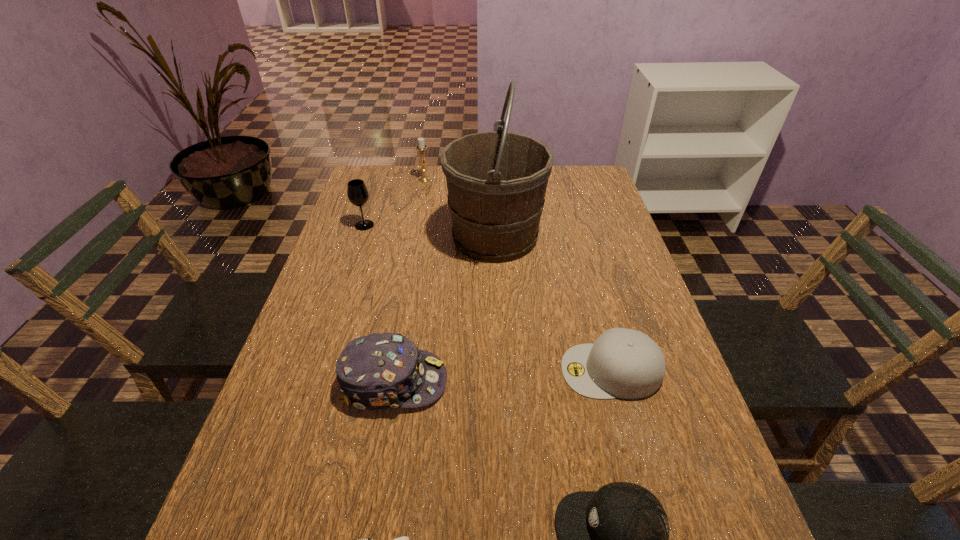
Locate an element on the screen. Image resolution: width=960 pixels, height=540 pixels. headwear that is positioned at the left edge is located at coordinates (379, 371).

At what (x,y) coordinates should I click in order to perform the action: click on object that is positioned at the right edge. Please return your answer as a coordinate pair (x, y). Looking at the image, I should click on (625, 363).

Image resolution: width=960 pixels, height=540 pixels. In the image, there is a desktop. Find the location of `vacant space at the far edge`. vacant space at the far edge is located at coordinates (441, 197).

In the image, there is a desktop. Where is `vacant space at the left edge`? Image resolution: width=960 pixels, height=540 pixels. vacant space at the left edge is located at coordinates (332, 447).

Locate an element on the screen. The width and height of the screenshot is (960, 540). vacant space at the right edge of the desktop is located at coordinates (724, 488).

You are a GUI agent. You are given a task and a screenshot of the screen. Output one action in this format:
    pyautogui.click(x=<x>, y=<y>)
    Task: Click on the vacant area at the far left corner of the desktop
    This screenshot has height=540, width=960.
    Given the screenshot: What is the action you would take?
    pyautogui.click(x=366, y=169)

You are a GUI agent. You are given a task and a screenshot of the screen. Output one action in this format:
    pyautogui.click(x=<x>, y=<y>)
    Task: Click on the free location at the far right corner
    The width and height of the screenshot is (960, 540).
    Given the screenshot: What is the action you would take?
    pyautogui.click(x=588, y=167)

What are the coordinates of `unoccupied position between the farthest object and the leftmost cap` in the screenshot? It's located at (409, 280).

You are a GUI agent. You are given a task and a screenshot of the screen. Output one action in this format:
    pyautogui.click(x=<x>, y=<y>)
    Task: Click on the empty space between the leftmost cap and the bucket
    This screenshot has height=540, width=960.
    Given the screenshot: What is the action you would take?
    pyautogui.click(x=444, y=309)

Choose which object is the sixth nearest neighbor to the farthest object. Please provide its 2D coordinates. Your answer should be formatted as a tuple, i.e. [(x, y)], where the tuple contains the x and y coordinates of a point satisfying the conditions above.

[(404, 539)]